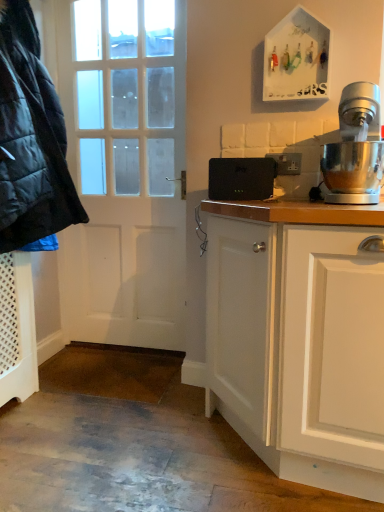
Question: Is matte black jacket at left turned away from white matte door at left?

Choices:
 (A) no
 (B) yes

Answer: (A)

Question: Is matte black jacket at left next to white matte door at left?

Choices:
 (A) yes
 (B) no

Answer: (B)

Question: Is matte black jacket at left bigger than white matte door at left?

Choices:
 (A) no
 (B) yes

Answer: (B)

Question: Considering the relative sizes of matte black jacket at left and white matte door at left in the image provided, is matte black jacket at left smaller than white matte door at left?

Choices:
 (A) no
 (B) yes

Answer: (A)

Question: Is matte black jacket at left behind white matte door at left?

Choices:
 (A) no
 (B) yes

Answer: (A)

Question: Considering the positions of white matte door at left and black plastic router at center in the image, is white matte door at left wider or thinner than black plastic router at center?

Choices:
 (A) thin
 (B) wide

Answer: (B)

Question: From the image's perspective, is white matte door at left located above or below black plastic router at center?

Choices:
 (A) above
 (B) below

Answer: (A)

Question: Is point (82, 121) closer or farther from the camera than point (238, 181)?

Choices:
 (A) farther
 (B) closer

Answer: (A)

Question: From a real-world perspective, is white matte door at left physically located above or below black plastic router at center?

Choices:
 (A) below
 (B) above

Answer: (A)

Question: Is point (77, 13) closer or farther from the camera than point (21, 196)?

Choices:
 (A) farther
 (B) closer

Answer: (A)

Question: Is white matte door at left wider or thinner than matte black jacket at left?

Choices:
 (A) thin
 (B) wide

Answer: (A)

Question: From a real-world perspective, relative to matte black jacket at left, is white matte door at left vertically above or below?

Choices:
 (A) below
 (B) above

Answer: (A)

Question: In terms of size, does white matte door at left appear bigger or smaller than matte black jacket at left?

Choices:
 (A) big
 (B) small

Answer: (B)

Question: From a real-world perspective, is polished stainless steel stand mixer at right physically located above or below black plastic router at center?

Choices:
 (A) above
 (B) below

Answer: (A)

Question: Relative to black plastic router at center, is polished stainless steel stand mixer at right in front or behind?

Choices:
 (A) behind
 (B) front

Answer: (B)